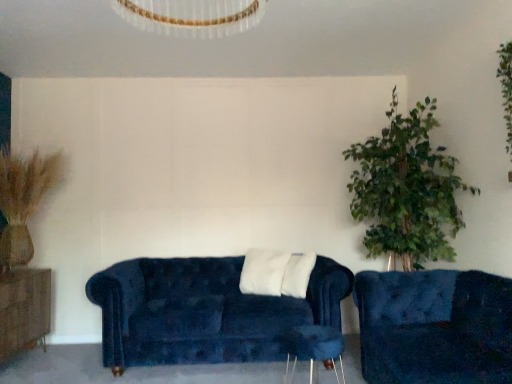
Identify the location of velvet blue couch at center, positioned as the second studio couch in right-to-left order. (204, 311).

In order to face brown wood dresser at left, should I rotate leftwards or rightwards?

To face it directly, rotate left by 31.253 degrees.

The height and width of the screenshot is (384, 512). What do you see at coordinates (24, 309) in the screenshot?
I see `brown wood dresser at left` at bounding box center [24, 309].

Find the location of `velvet blue couch at center, which is counted as the 2th studio couch, starting from the front`. velvet blue couch at center, which is counted as the 2th studio couch, starting from the front is located at coordinates (204, 311).

Can you see velvet blue couch at lower right, the second studio couch viewed from the back, touching brown wood dresser at left?

They are not placed beside each other.

Which is behind, velvet blue couch at lower right, the second studio couch viewed from the back, or brown wood dresser at left?

brown wood dresser at left is behind.

Which object is thinner, velvet blue couch at lower right, which appears as the 1th studio couch when viewed from the right, or brown wood dresser at left?

Thinner between the two is brown wood dresser at left.

From a real-world perspective, is wooden side table at lower center positioned above or below velvet blue couch at center, positioned as the second studio couch in right-to-left order?

From a real-world perspective, wooden side table at lower center is physically below velvet blue couch at center, positioned as the second studio couch in right-to-left order.

From the image's perspective, is wooden side table at lower center above velvet blue couch at center, positioned as the first studio couch in back-to-front order?

Incorrect, from the image's perspective, wooden side table at lower center is lower than velvet blue couch at center, positioned as the first studio couch in back-to-front order.

Does wooden side table at lower center have a larger size compared to velvet blue couch at center, positioned as the second studio couch in right-to-left order?

No.

Is wooden side table at lower center thinner than velvet blue couch at center, positioned as the first studio couch in back-to-front order?

Indeed, wooden side table at lower center has a lesser width compared to velvet blue couch at center, positioned as the first studio couch in back-to-front order.

Does velvet blue couch at lower right, which appears as the 1th studio couch when viewed from the right, have a lesser width compared to wooden side table at lower center?

No.

From their relative heights in the image, would you say velvet blue couch at lower right, which is the 1th studio couch from front to back, is taller or shorter than wooden side table at lower center?

velvet blue couch at lower right, which is the 1th studio couch from front to back, is taller than wooden side table at lower center.

Could you tell me if velvet blue couch at lower right, the second studio couch viewed from the back, is facing wooden side table at lower center?

Yes, velvet blue couch at lower right, the second studio couch viewed from the back, faces towards wooden side table at lower center.

Does point (240, 311) come in front of point (292, 349)?

Yes, point (240, 311) is closer to viewer.

Looking at this image, how far apart are velvet blue couch at center, which is counted as the 2th studio couch, starting from the front, and wooden side table at lower center?

The distance of velvet blue couch at center, which is counted as the 2th studio couch, starting from the front, from wooden side table at lower center is 21.95 inches.

From the image's perspective, would you say velvet blue couch at center, positioned as the first studio couch in back-to-front order, is shown under wooden side table at lower center?

Incorrect, from the image's perspective, velvet blue couch at center, positioned as the first studio couch in back-to-front order, is higher than wooden side table at lower center.

Can you tell me how much velvet blue couch at center, positioned as the second studio couch in right-to-left order, and wooden side table at lower center differ in facing direction?

They differ by 84.1 degrees in their facing directions.

From a real-world perspective, between velvet blue couch at center, which is counted as the 2th studio couch, starting from the front, and brown wood dresser at left, who is vertically lower?

brown wood dresser at left is physically lower.

Can you see velvet blue couch at center, placed as the first studio couch when sorted from left to right, touching brown wood dresser at left?

No, velvet blue couch at center, placed as the first studio couch when sorted from left to right, is not making contact with brown wood dresser at left.

From the picture: Would you say velvet blue couch at center, placed as the first studio couch when sorted from left to right, is inside or outside brown wood dresser at left?

velvet blue couch at center, placed as the first studio couch when sorted from left to right, is not enclosed by brown wood dresser at left.

Between point (238, 354) and point (40, 335), which one is positioned behind?

Positioned behind is point (40, 335).

Considering the points (372, 375) and (148, 324), which point is behind, point (372, 375) or point (148, 324)?

The point (148, 324) is farther.

Is velvet blue couch at lower right, which is the 1th studio couch from front to back, looking in the opposite direction of velvet blue couch at center, positioned as the first studio couch in back-to-front order?

No, velvet blue couch at lower right, which is the 1th studio couch from front to back, is not facing away from velvet blue couch at center, positioned as the first studio couch in back-to-front order.

Does velvet blue couch at lower right, the 2th studio couch when ordered from left to right, have a lesser width compared to velvet blue couch at center, which is counted as the 2th studio couch, starting from the front?

No, velvet blue couch at lower right, the 2th studio couch when ordered from left to right, is not thinner than velvet blue couch at center, which is counted as the 2th studio couch, starting from the front.

Does wooden side table at lower center have a lesser width compared to brown wood dresser at left?

Yes.

Can you confirm if wooden side table at lower center is bigger than brown wood dresser at left?

Actually, wooden side table at lower center might be smaller than brown wood dresser at left.

From the image's perspective, is wooden side table at lower center below brown wood dresser at left?

Yes.

Between wooden side table at lower center and brown wood dresser at left, which one appears on the right side from the viewer's perspective?

Positioned to the right is wooden side table at lower center.

Where is `studio couch in front of the brown wood dresser at left`? studio couch in front of the brown wood dresser at left is located at coordinates tap(434, 327).

From a real-world perspective, which studio couch is the 2nd one above the wooden side table at lower center? Please provide its 2D coordinates.

[(204, 311)]

When comparing their distances from wooden side table at lower center, does brown wood dresser at left or velvet blue couch at lower right, which appears as the 1th studio couch when viewed from the right, seem closer?

velvet blue couch at lower right, which appears as the 1th studio couch when viewed from the right, lies closer to wooden side table at lower center than the other object.

Looking at the image, which one is located closer to wooden side table at lower center, velvet blue couch at lower right, which appears as the 1th studio couch when viewed from the right, or velvet blue couch at center, which is counted as the 2th studio couch, starting from the front?

velvet blue couch at center, which is counted as the 2th studio couch, starting from the front, is closer to wooden side table at lower center.

Consider the image. Estimate the real-world distances between objects in this image. Which object is closer to velvet blue couch at lower right, the 2th studio couch when ordered from left to right, wooden side table at lower center or brown wood dresser at left?

wooden side table at lower center is closer to velvet blue couch at lower right, the 2th studio couch when ordered from left to right.

Based on their spatial positions, is velvet blue couch at center, which is counted as the 2th studio couch, starting from the front, or brown wood dresser at left closer to velvet blue couch at lower right, which is the 1th studio couch from front to back?

The object closer to velvet blue couch at lower right, which is the 1th studio couch from front to back, is velvet blue couch at center, which is counted as the 2th studio couch, starting from the front.

Which object lies nearer to the anchor point wooden side table at lower center, velvet blue couch at center, positioned as the second studio couch in right-to-left order, or brown wood dresser at left?

The object closer to wooden side table at lower center is velvet blue couch at center, positioned as the second studio couch in right-to-left order.

Considering their positions, is velvet blue couch at center, which is counted as the 2th studio couch, starting from the front, positioned further to brown wood dresser at left than velvet blue couch at lower right, the second studio couch viewed from the back?

The object further to brown wood dresser at left is velvet blue couch at lower right, the second studio couch viewed from the back.

Which object lies further to the anchor point velvet blue couch at center, positioned as the second studio couch in right-to-left order, brown wood dresser at left or wooden side table at lower center?

brown wood dresser at left lies further to velvet blue couch at center, positioned as the second studio couch in right-to-left order, than the other object.

Estimate the real-world distances between objects in this image. Which object is closer to velvet blue couch at center, positioned as the first studio couch in back-to-front order, brown wood dresser at left or velvet blue couch at lower right, the second studio couch viewed from the back?

Among the two, velvet blue couch at lower right, the second studio couch viewed from the back, is located nearer to velvet blue couch at center, positioned as the first studio couch in back-to-front order.

The image size is (512, 384). I want to click on studio couch situated between brown wood dresser at left and wooden side table at lower center from left to right, so click(x=204, y=311).

Where is `studio couch between brown wood dresser at left and velvet blue couch at lower right, which is the 1th studio couch from front to back, in the horizontal direction`? The height and width of the screenshot is (384, 512). studio couch between brown wood dresser at left and velvet blue couch at lower right, which is the 1th studio couch from front to back, in the horizontal direction is located at coordinates (204, 311).

At what (x,y) coordinates should I click in order to perform the action: click on side table between brown wood dresser at left and velvet blue couch at lower right, the second studio couch viewed from the back, from left to right. Please return your answer as a coordinate pair (x, y). The height and width of the screenshot is (384, 512). Looking at the image, I should click on (314, 347).

Where is `side table positioned between velvet blue couch at lower right, the 2th studio couch when ordered from left to right, and velvet blue couch at center, which is counted as the 2th studio couch, starting from the front, from near to far`? This screenshot has width=512, height=384. side table positioned between velvet blue couch at lower right, the 2th studio couch when ordered from left to right, and velvet blue couch at center, which is counted as the 2th studio couch, starting from the front, from near to far is located at coordinates (314, 347).